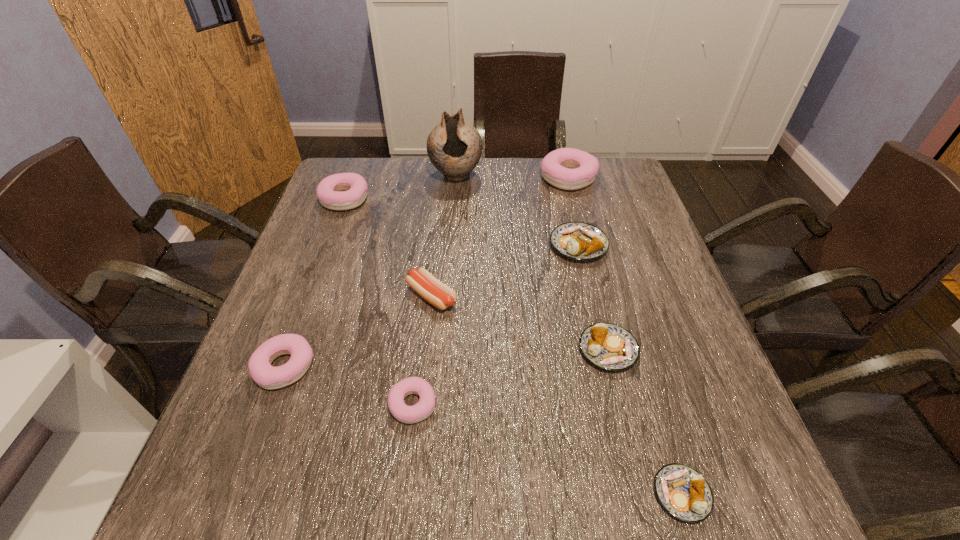
Where is `pottery`? Image resolution: width=960 pixels, height=540 pixels. pottery is located at coordinates (454, 146).

Locate an element on the screen. the rightmost pink pastry is located at coordinates (566, 168).

The height and width of the screenshot is (540, 960). I want to click on the eighth shortest object, so click(x=566, y=168).

This screenshot has width=960, height=540. I want to click on the third smallest pink pastry, so click(353, 187).

This screenshot has width=960, height=540. I want to click on the biggest brown pastry, so click(581, 241).

This screenshot has width=960, height=540. What are the coordinates of `the fourth farthest object` in the screenshot? It's located at (581, 241).

Where is `the second smallest pink pastry`? the second smallest pink pastry is located at coordinates (262, 372).

Find the location of a particular element. The height and width of the screenshot is (540, 960). brown sausage is located at coordinates (438, 294).

Locate an element on the screen. The width and height of the screenshot is (960, 540). sausage is located at coordinates (438, 294).

This screenshot has height=540, width=960. I want to click on the second biggest brown pastry, so click(608, 346).